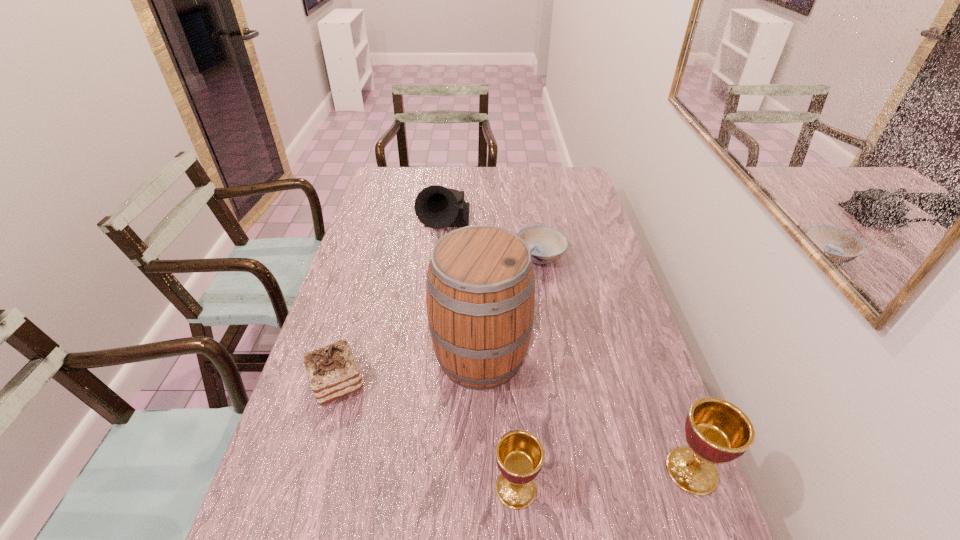
Please point out where to position a new chalice on the left to maintain spacing. Please provide its 2D coordinates. Your answer should be formatted as a tuple, i.e. [(x, y)], where the tuple contains the x and y coordinates of a point satisfying the conditions above.

[(329, 507)]